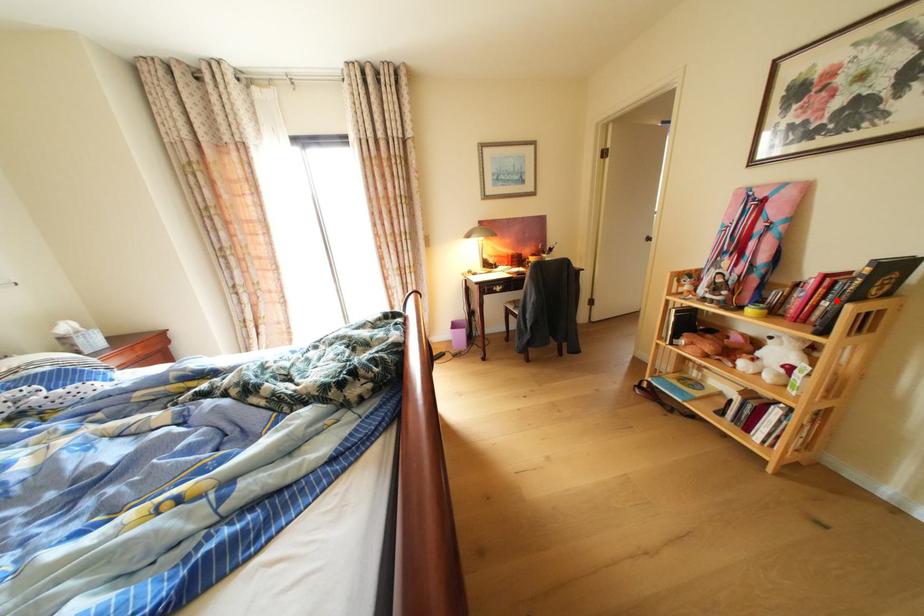
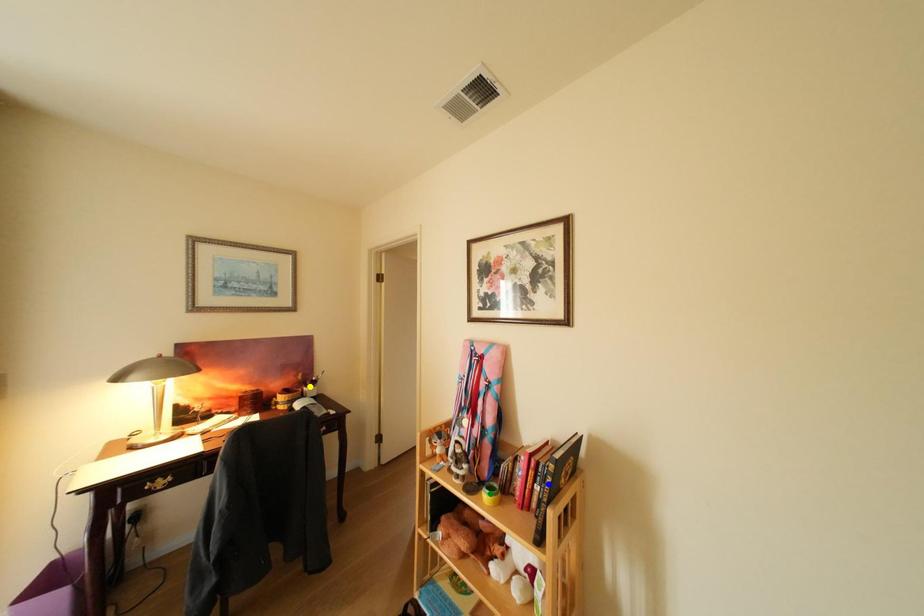
Question: I am providing you with two images of the same scene from different viewpoints. A red point is marked on the first image. You are given multiple points on the second image. Which mark in image 2 goes with the point in image 1?

Choices:
 (A) green point
 (B) yellow point
 (C) blue point

Answer: (C)